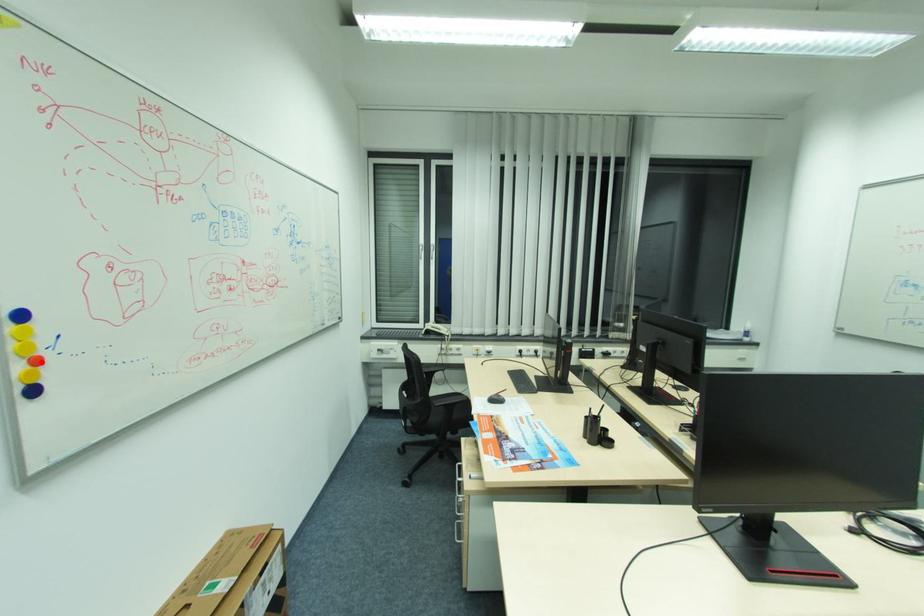
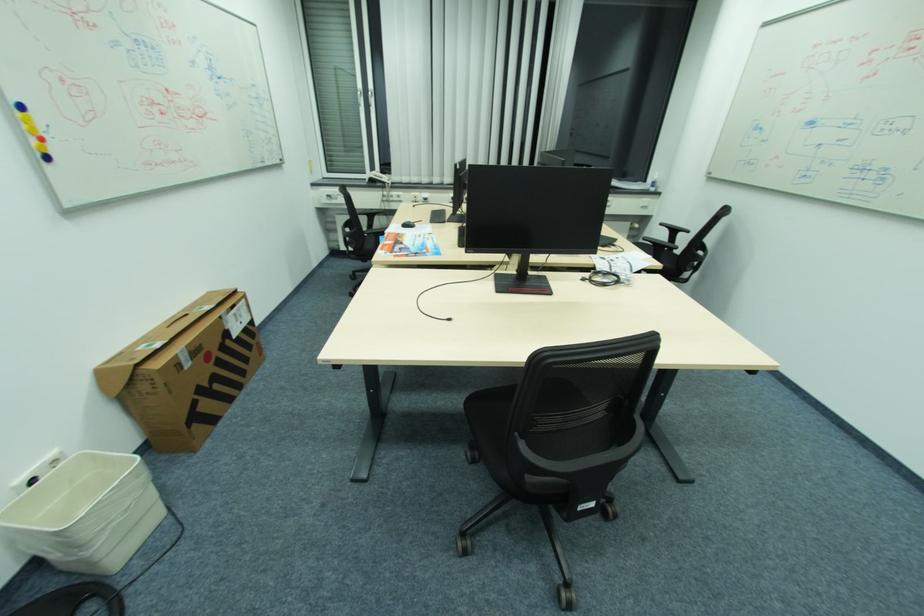
In the second image, find the point that corresponds to the highlighted location in the first image.

(44, 140)